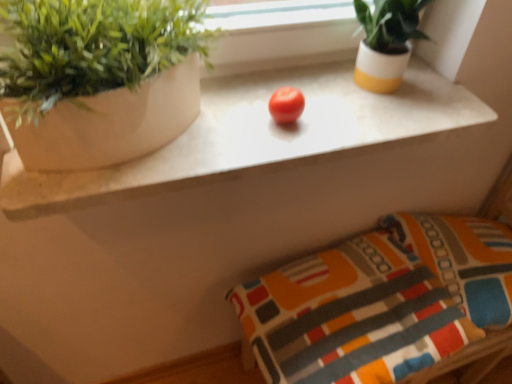
Where is `free spot in front of white glossy pot at upper right`? free spot in front of white glossy pot at upper right is located at coordinates (373, 119).